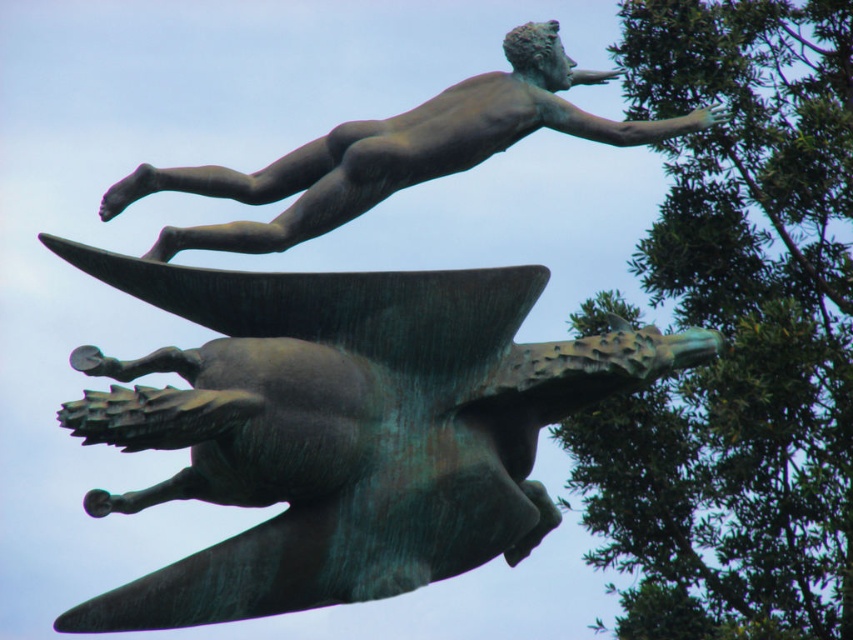
Question: Which point is closer to the camera?

Choices:
 (A) (200, 170)
 (B) (695, 323)

Answer: (A)

Question: Among these points, which one is nearest to the camera?

Choices:
 (A) (602, 136)
 (B) (665, 109)

Answer: (A)

Question: Is green leafy tree at upper right to the right of bronze statue at upper center from the viewer's perspective?

Choices:
 (A) yes
 (B) no

Answer: (A)

Question: Can you confirm if green leafy tree at upper right is positioned below bronze statue at upper center?

Choices:
 (A) yes
 (B) no

Answer: (A)

Question: Can you confirm if green leafy tree at upper right is positioned to the left of bronze statue at upper center?

Choices:
 (A) yes
 (B) no

Answer: (B)